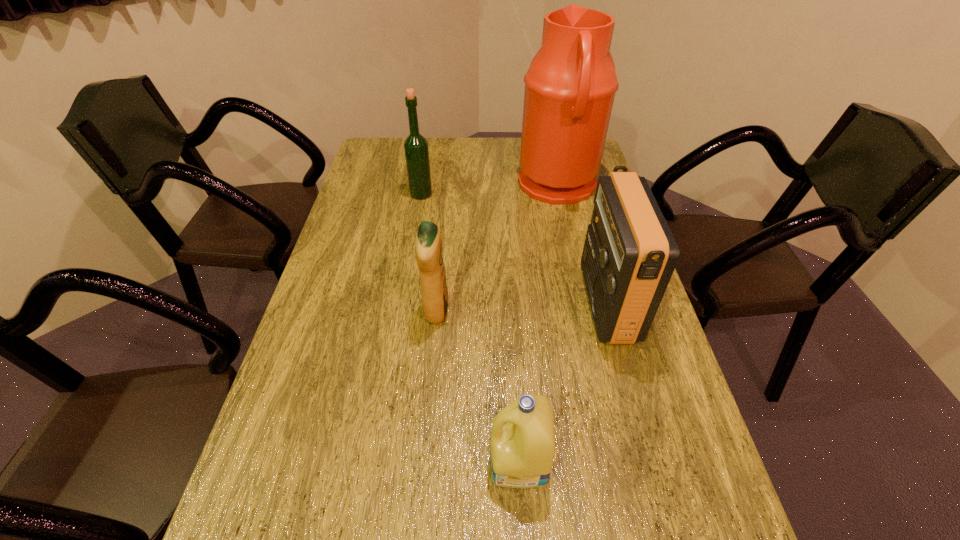
Identify the location of radio receiver located at the right edge. (629, 255).

The width and height of the screenshot is (960, 540). I want to click on object that is positioned at the far right corner, so click(570, 87).

Where is `vacant space at the far edge`? vacant space at the far edge is located at coordinates (465, 137).

At what (x,y) coordinates should I click in order to perform the action: click on free location at the left edge. Please return your answer as a coordinate pair (x, y). The image size is (960, 540). Looking at the image, I should click on (272, 526).

What are the coordinates of `vacant area at the right edge of the desktop` in the screenshot? It's located at (657, 495).

This screenshot has width=960, height=540. Identify the location of free space at the far left corner. (370, 160).

The image size is (960, 540). Identify the location of vacant space that is in between the left detergent and the radio receiver. (521, 307).

Locate an element on the screen. free point between the left detergent and the radio receiver is located at coordinates (521, 307).

Where is `unoccupied area between the leftmost object and the tallest object`? unoccupied area between the leftmost object and the tallest object is located at coordinates (490, 190).

Where is `empty location between the shorter detergent and the left detergent`? Image resolution: width=960 pixels, height=540 pixels. empty location between the shorter detergent and the left detergent is located at coordinates (478, 386).